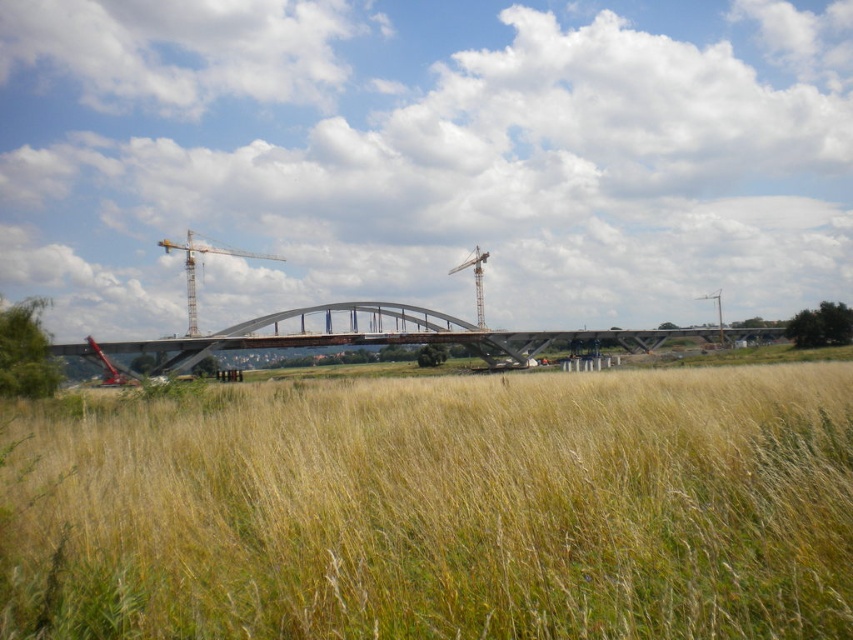
Question: Based on their relative distances, which object is farther from the metallic silver crane at center?

Choices:
 (A) metallic gray crane at upper center
 (B) metallic gray crane at center
 (C) yellow grass at lower center

Answer: (C)

Question: Which object appears closest to the camera in this image?

Choices:
 (A) metallic silver crane at center
 (B) yellow grass at lower center

Answer: (B)

Question: Among these points, which one is farthest from the camera?

Choices:
 (A) (192, 324)
 (B) (306, 339)
 (C) (293, 525)

Answer: (A)

Question: Is the position of yellow grass at lower center more distant than that of metallic silver crane at center?

Choices:
 (A) no
 (B) yes

Answer: (A)

Question: Can you confirm if concrete bridge at center is positioned to the left of metallic gray crane at upper center?

Choices:
 (A) yes
 (B) no

Answer: (A)

Question: Does yellow grass at lower center appear under metallic gray crane at center?

Choices:
 (A) no
 (B) yes

Answer: (B)